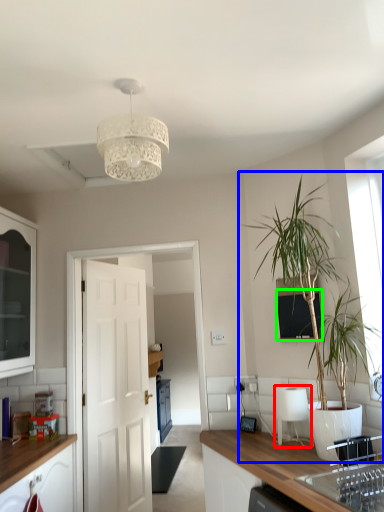
Question: Based on their relative distances, which object is farther from appliance (highlighted by a red box)? Choose from houseplant (highlighted by a blue box) and window screen (highlighted by a green box).

Choices:
 (A) houseplant
 (B) window screen

Answer: (A)